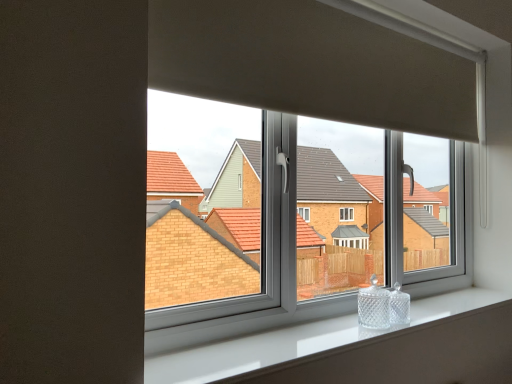
I want to click on free location above white glossy window sill at lower center (from a real-world perspective), so click(310, 328).